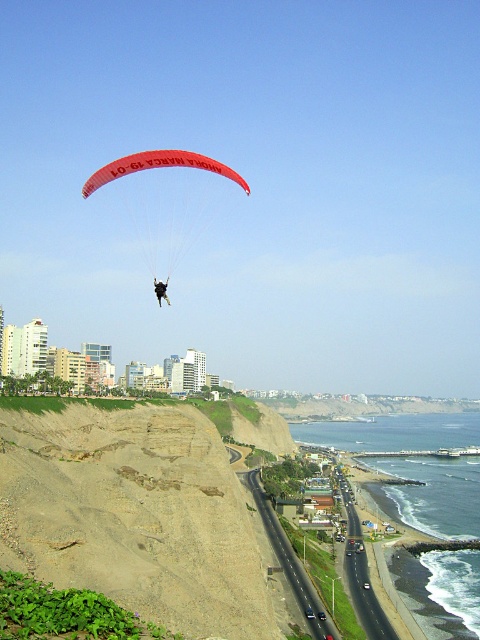
From the picture: Who is higher up, red nylon parachute at center or black fabric parachute at upper center?

red nylon parachute at center

Consider the image. Does red nylon parachute at center have a greater height compared to black fabric parachute at upper center?

Yes, red nylon parachute at center is taller than black fabric parachute at upper center.

Find the location of a particular element. The width and height of the screenshot is (480, 640). red nylon parachute at center is located at coordinates (158, 166).

Find the location of a particular element. The width and height of the screenshot is (480, 640). red nylon parachute at center is located at coordinates (158, 166).